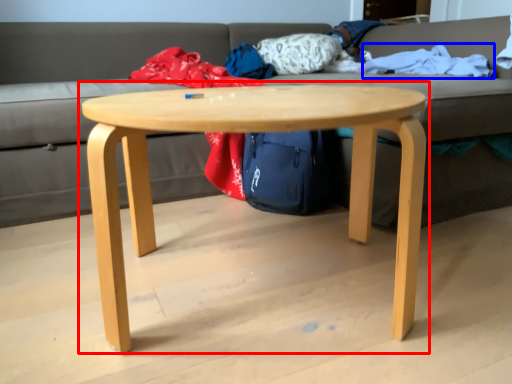
Question: Which point is further to the camera, coffee table (highlighted by a red box) or blanket (highlighted by a blue box)?

Choices:
 (A) coffee table
 (B) blanket

Answer: (B)